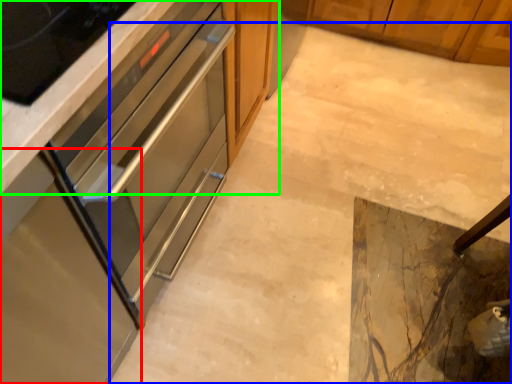
Question: Which object is positioned closest to cabinetry (highlighted by a red box)? Select from concrete (highlighted by a blue box) and cabinetry (highlighted by a green box).

Choices:
 (A) concrete
 (B) cabinetry

Answer: (B)